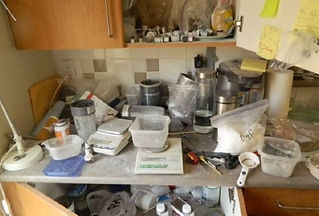
The height and width of the screenshot is (216, 319). I want to click on glass of water, so click(201, 119).